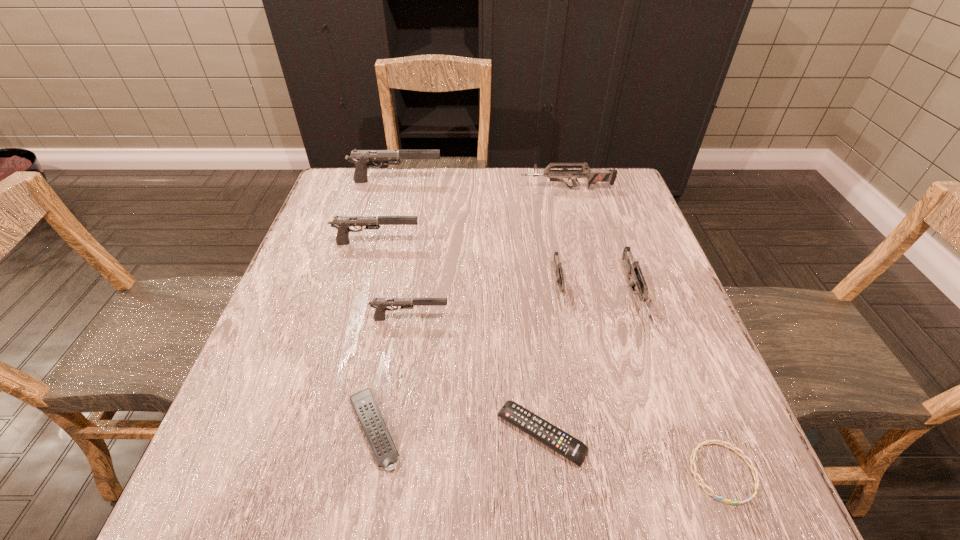
The image size is (960, 540). In order to click on the farthest gun in this screenshot , I will do (x=361, y=158).

You are a GUI agent. You are given a task and a screenshot of the screen. Output one action in this format:
    pyautogui.click(x=<x>, y=<y>)
    Task: Click on the farthest object
    Image resolution: width=960 pixels, height=540 pixels.
    Given the screenshot: What is the action you would take?
    pyautogui.click(x=361, y=158)

This screenshot has height=540, width=960. Identify the location of the farthest grey gun. (593, 176).

The height and width of the screenshot is (540, 960). What are the coordinates of `the second farthest object` in the screenshot? It's located at (593, 176).

The height and width of the screenshot is (540, 960). In order to click on the third farthest object in this screenshot , I will do `click(342, 223)`.

The width and height of the screenshot is (960, 540). I want to click on the fourth nearest gun, so click(342, 223).

Image resolution: width=960 pixels, height=540 pixels. What are the coordinates of `the second biggest grey gun` in the screenshot? It's located at (633, 268).

Where is `the nearest gray gun`? This screenshot has height=540, width=960. the nearest gray gun is located at coordinates (380, 304).

Where is `the smallest grey gun`? This screenshot has width=960, height=540. the smallest grey gun is located at coordinates (560, 279).

This screenshot has width=960, height=540. What are the coordinates of `the sixth tallest object` in the screenshot? It's located at [x=560, y=279].